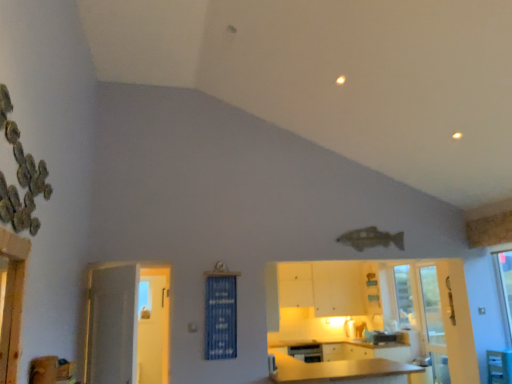
Question: From the image's perspective, is matte wood cabinetry at center, which is the 2th cabinetry in back-to-front order, on green plastic table at lower right?

Choices:
 (A) no
 (B) yes

Answer: (A)

Question: Is matte wood cabinetry at center, which is the 2th cabinetry in back-to-front order, facing towards green plastic table at lower right?

Choices:
 (A) yes
 (B) no

Answer: (A)

Question: Does matte wood cabinetry at center, which is the 2th cabinetry in back-to-front order, have a greater width compared to green plastic table at lower right?

Choices:
 (A) yes
 (B) no

Answer: (A)

Question: From a real-world perspective, is matte wood cabinetry at center, which is the 2th cabinetry in back-to-front order, positioned over green plastic table at lower right based on gravity?

Choices:
 (A) yes
 (B) no

Answer: (B)

Question: Is green plastic table at lower right inside matte wood cabinetry at center, which is the 2th cabinetry in back-to-front order?

Choices:
 (A) yes
 (B) no

Answer: (B)

Question: Is yellow matte dishwasher at lower center at the back of white glossy cabinets at center, the second cabinetry in the front-to-back sequence?

Choices:
 (A) yes
 (B) no

Answer: (B)

Question: Can you confirm if white glossy cabinets at center, which is the 1th cabinetry in back-to-front order, is thinner than yellow matte dishwasher at lower center?

Choices:
 (A) yes
 (B) no

Answer: (A)

Question: Is yellow matte dishwasher at lower center completely or partially inside white glossy cabinets at center, which is the 1th cabinetry in back-to-front order?

Choices:
 (A) yes
 (B) no

Answer: (B)

Question: Does white glossy cabinets at center, which is the 1th cabinetry in back-to-front order, appear on the left side of yellow matte dishwasher at lower center?

Choices:
 (A) no
 (B) yes

Answer: (A)

Question: Considering the relative sizes of white glossy cabinets at center, the second cabinetry in the front-to-back sequence, and yellow matte dishwasher at lower center in the image provided, is white glossy cabinets at center, the second cabinetry in the front-to-back sequence, wider than yellow matte dishwasher at lower center?

Choices:
 (A) yes
 (B) no

Answer: (B)

Question: Is white glossy cabinets at center, the second cabinetry in the front-to-back sequence, in contact with yellow matte dishwasher at lower center?

Choices:
 (A) yes
 (B) no

Answer: (B)

Question: Can you confirm if clear glass screen door at lower right is wider than white glossy door at left?

Choices:
 (A) yes
 (B) no

Answer: (A)